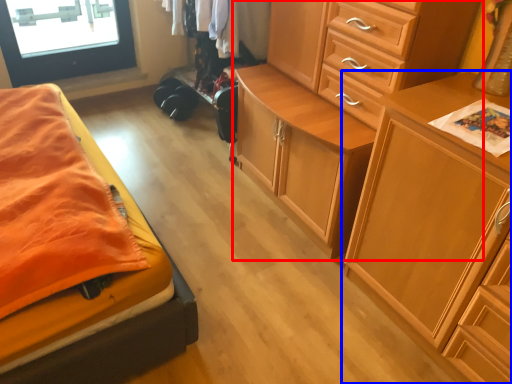
Question: Which object is further to the camera taking this photo, chest of drawers (highlighted by a red box) or chest of drawers (highlighted by a blue box)?

Choices:
 (A) chest of drawers
 (B) chest of drawers

Answer: (A)